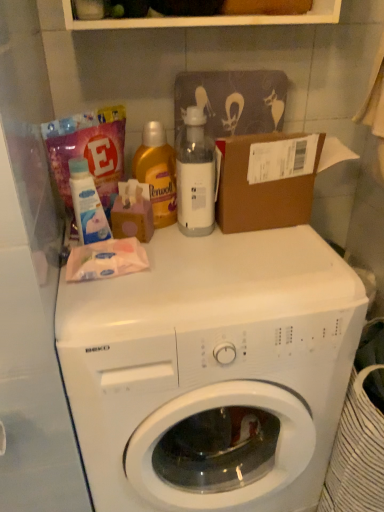
Question: Is white plastic bottle at center inside white glossy washing machine at center?

Choices:
 (A) no
 (B) yes

Answer: (A)

Question: From a real-world perspective, is white glossy washing machine at center on white plastic bottle at center?

Choices:
 (A) yes
 (B) no

Answer: (B)

Question: Considering the relative sizes of white glossy washing machine at center and white plastic bottle at center in the image provided, is white glossy washing machine at center smaller than white plastic bottle at center?

Choices:
 (A) no
 (B) yes

Answer: (A)

Question: Is white plastic bottle at center at the back of white glossy washing machine at center?

Choices:
 (A) no
 (B) yes

Answer: (A)

Question: Would you consider white glossy washing machine at center to be distant from white plastic bottle at center?

Choices:
 (A) no
 (B) yes

Answer: (A)

Question: From the image's perspective, is white glossy washing machine at center located above white plastic bottle at center?

Choices:
 (A) yes
 (B) no

Answer: (B)

Question: Is pink polka dot tissue box at upper center surrounding white glossy lotion at upper left, the second cleaning product when ordered from right to left?

Choices:
 (A) yes
 (B) no

Answer: (B)

Question: Does pink polka dot tissue box at upper center have a greater width compared to white glossy lotion at upper left, the second cleaning product when ordered from right to left?

Choices:
 (A) yes
 (B) no

Answer: (A)

Question: Is pink polka dot tissue box at upper center with white glossy lotion at upper left, the second cleaning product when ordered from right to left?

Choices:
 (A) no
 (B) yes

Answer: (B)

Question: Can you confirm if pink polka dot tissue box at upper center is positioned to the right of white glossy lotion at upper left, the 1th cleaning product in the left-to-right sequence?

Choices:
 (A) no
 (B) yes

Answer: (B)

Question: Does pink polka dot tissue box at upper center have a larger size compared to white glossy lotion at upper left, the 1th cleaning product in the left-to-right sequence?

Choices:
 (A) no
 (B) yes

Answer: (B)

Question: Is pink polka dot tissue box at upper center taller than white glossy lotion at upper left, the 1th cleaning product in the left-to-right sequence?

Choices:
 (A) no
 (B) yes

Answer: (A)

Question: Is white plastic bottle at center not inside white glossy washing machine at center?

Choices:
 (A) no
 (B) yes

Answer: (B)